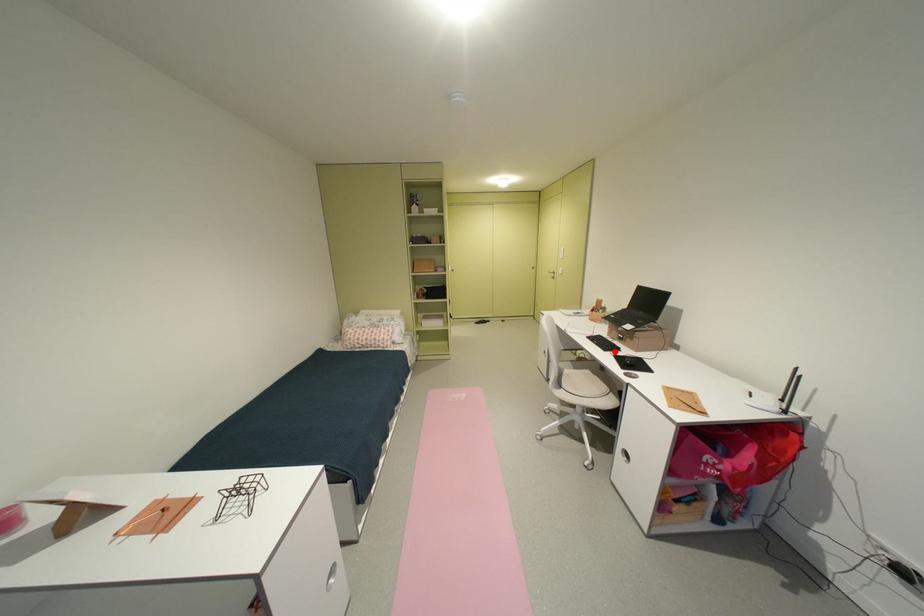
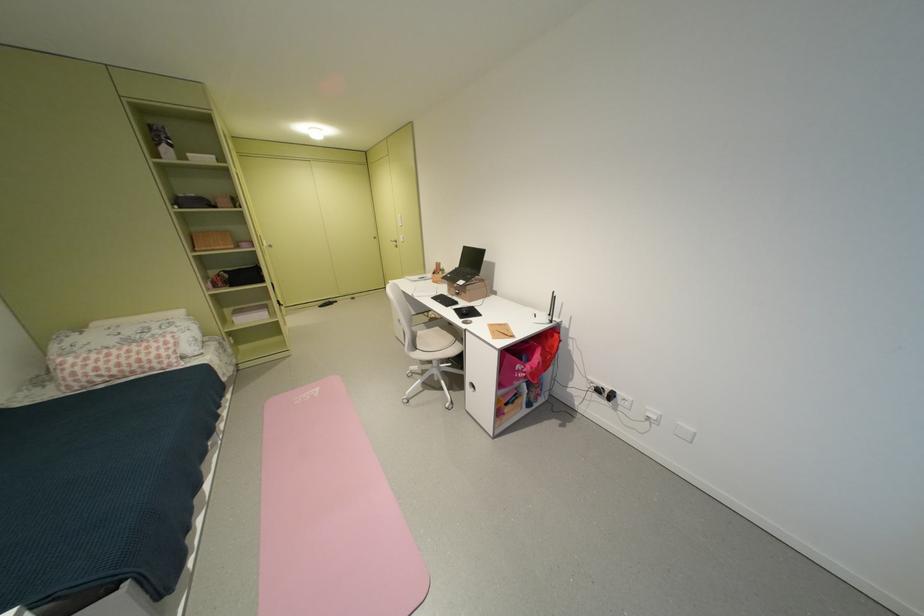
The point at the highlighted location is marked in the first image. Where is the corresponding point in the second image?

(456, 307)